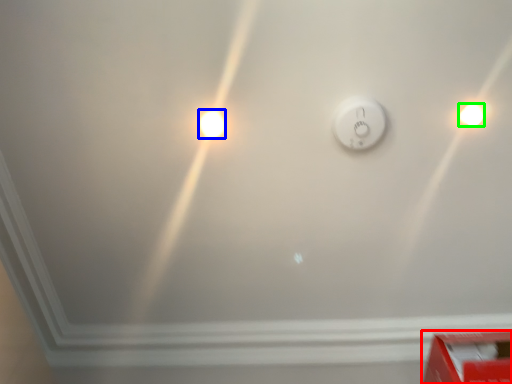
Question: Which object is positioned closest to box (highlighted by a red box)? Select from light bulb (highlighted by a blue box) and light bulb (highlighted by a green box).

Choices:
 (A) light bulb
 (B) light bulb

Answer: (B)